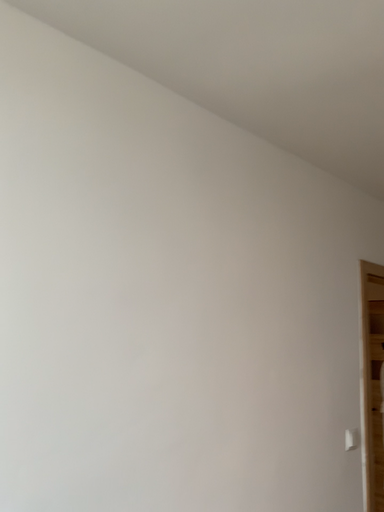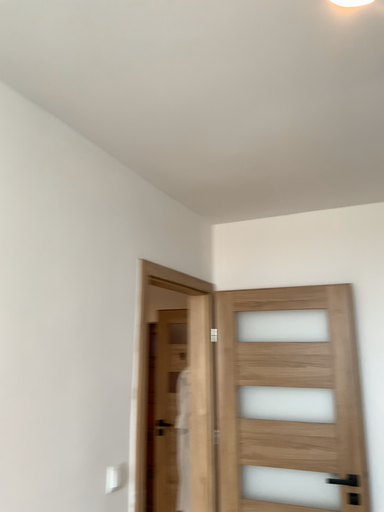
Question: Which way did the camera rotate in the video?

Choices:
 (A) rotated left
 (B) rotated right

Answer: (B)